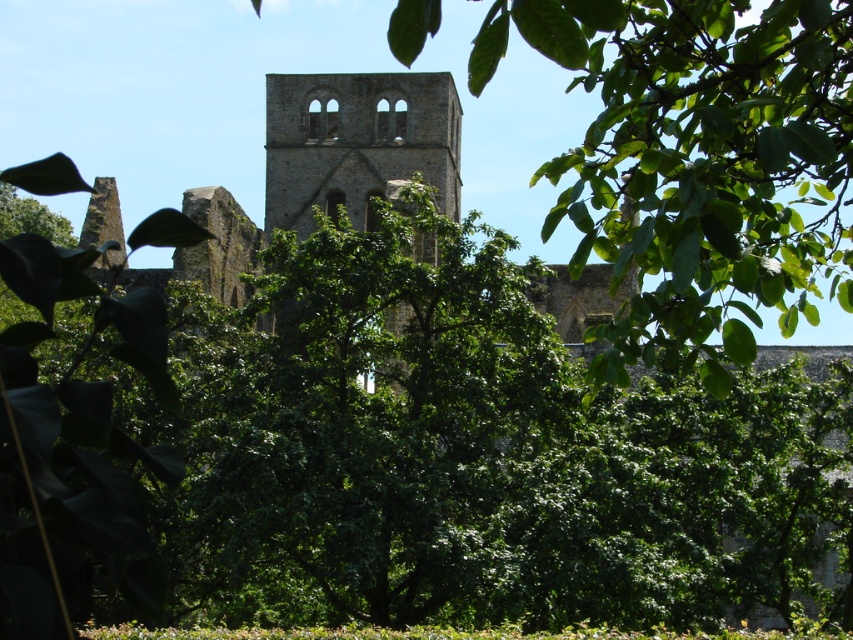
You are standing in front of the ruins and want to take a photo that includes both the green leafy tree at center and the brown stone tower at center. Which object should you position closer to the front of your photo to ensure both are in the frame?

The green leafy tree at center is closer to the viewer than the brown stone tower at center, so you should position the green leafy tree at center closer to the front of your photo to ensure both are in the frame.

Based on the photo, you are an architect examining the ruins of an old building. You notice a green leafy tree at center and a brown stone tower at center. Which object occupies more space in the image?

The green leafy tree at center is larger in size than the brown stone tower at center, so it occupies more space in the image.